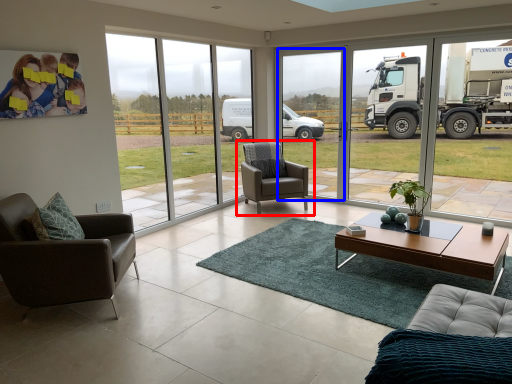
Question: Which object is further to the camera taking this photo, chair (highlighted by a red box) or window frame (highlighted by a blue box)?

Choices:
 (A) chair
 (B) window frame

Answer: (B)